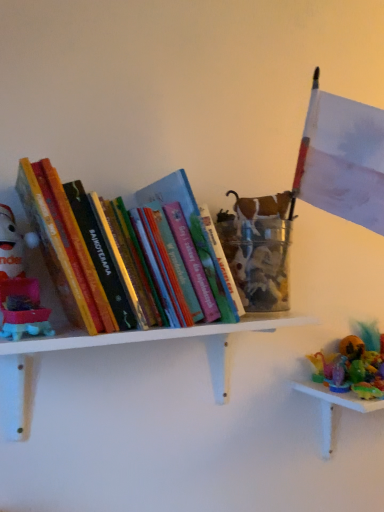
Question: Is white matte shelf at upper left inside plush red santa at left?

Choices:
 (A) no
 (B) yes

Answer: (A)

Question: Is plush red santa at left directly adjacent to white matte shelf at upper left?

Choices:
 (A) yes
 (B) no

Answer: (B)

Question: Is plush red santa at left aimed at white matte shelf at upper left?

Choices:
 (A) yes
 (B) no

Answer: (B)

Question: From the image's perspective, is plush red santa at left beneath white matte shelf at upper left?

Choices:
 (A) yes
 (B) no

Answer: (B)

Question: From a real-world perspective, is plush red santa at left on top of white matte shelf at upper left?

Choices:
 (A) yes
 (B) no

Answer: (A)

Question: From a real-world perspective, relative to hardcover books at left, is plush red santa at left vertically above or below?

Choices:
 (A) below
 (B) above

Answer: (A)

Question: Considering the positions of point (18, 304) and point (84, 209), is point (18, 304) closer or farther from the camera than point (84, 209)?

Choices:
 (A) farther
 (B) closer

Answer: (A)

Question: In the image, is plush red santa at left on the left side or the right side of hardcover books at left?

Choices:
 (A) left
 (B) right

Answer: (A)

Question: In the image, is plush red santa at left positioned in front of or behind hardcover books at left?

Choices:
 (A) behind
 (B) front

Answer: (A)

Question: Is hardcover books at left spatially inside white matte shelf at upper left, or outside of it?

Choices:
 (A) outside
 (B) inside

Answer: (A)

Question: Considering the positions of point (104, 291) and point (19, 396), is point (104, 291) closer or farther from the camera than point (19, 396)?

Choices:
 (A) closer
 (B) farther

Answer: (A)

Question: In terms of width, does hardcover books at left look wider or thinner when compared to white matte shelf at upper left?

Choices:
 (A) wide
 (B) thin

Answer: (A)

Question: In terms of size, does hardcover books at left appear bigger or smaller than white matte shelf at upper left?

Choices:
 (A) small
 (B) big

Answer: (B)

Question: Is point (82, 310) positioned closer to the camera than point (6, 291)?

Choices:
 (A) closer
 (B) farther

Answer: (A)

Question: Is hardcover books at left bigger or smaller than plush red santa at left?

Choices:
 (A) small
 (B) big

Answer: (B)